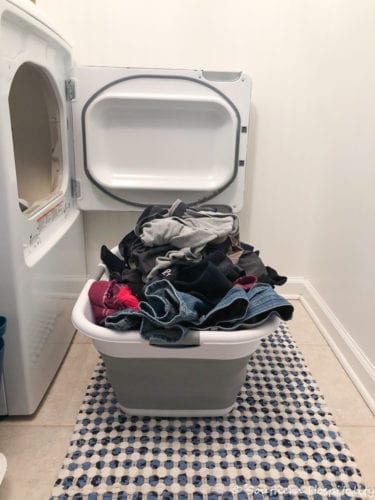
Identify the location of laundry basket. Image resolution: width=375 pixels, height=500 pixels. (207, 361).